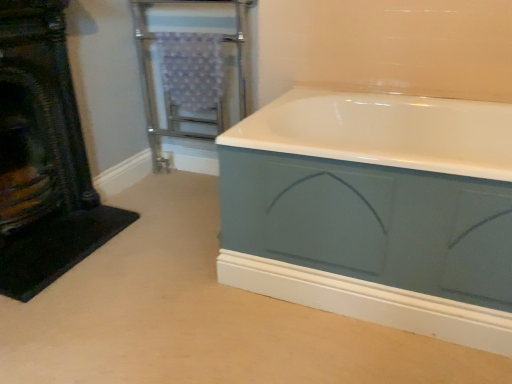
Question: Is metallic silver towel rack at upper left positioned before matte blue bathtub at center?

Choices:
 (A) no
 (B) yes

Answer: (A)

Question: Is metallic silver towel rack at upper left shorter than matte blue bathtub at center?

Choices:
 (A) no
 (B) yes

Answer: (A)

Question: Can you confirm if metallic silver towel rack at upper left is positioned to the right of matte blue bathtub at center?

Choices:
 (A) yes
 (B) no

Answer: (B)

Question: From a real-world perspective, is metallic silver towel rack at upper left on top of matte blue bathtub at center?

Choices:
 (A) yes
 (B) no

Answer: (A)

Question: Is the depth of metallic silver towel rack at upper left greater than that of matte blue bathtub at center?

Choices:
 (A) yes
 (B) no

Answer: (A)

Question: From a real-world perspective, is matte blue bathtub at center positioned above or below black textured fireplace at left?

Choices:
 (A) above
 (B) below

Answer: (B)

Question: From the image's perspective, relative to black textured fireplace at left, is matte blue bathtub at center above or below?

Choices:
 (A) above
 (B) below

Answer: (B)

Question: In terms of width, does matte blue bathtub at center look wider or thinner when compared to black textured fireplace at left?

Choices:
 (A) thin
 (B) wide

Answer: (B)

Question: Would you say matte blue bathtub at center is to the left or to the right of black textured fireplace at left in the picture?

Choices:
 (A) left
 (B) right

Answer: (B)

Question: From the image's perspective, is black textured fireplace at left located above or below metallic silver towel rack at upper left?

Choices:
 (A) below
 (B) above

Answer: (A)

Question: From a real-world perspective, is black textured fireplace at left above or below metallic silver towel rack at upper left?

Choices:
 (A) below
 (B) above

Answer: (B)

Question: Is point (90, 188) positioned closer to the camera than point (148, 44)?

Choices:
 (A) closer
 (B) farther

Answer: (A)

Question: In terms of width, does black textured fireplace at left look wider or thinner when compared to metallic silver towel rack at upper left?

Choices:
 (A) thin
 (B) wide

Answer: (A)

Question: Considering the positions of matte blue bathtub at center and metallic silver towel rack at upper left in the image, is matte blue bathtub at center bigger or smaller than metallic silver towel rack at upper left?

Choices:
 (A) small
 (B) big

Answer: (B)

Question: From the image's perspective, is matte blue bathtub at center located above or below metallic silver towel rack at upper left?

Choices:
 (A) above
 (B) below

Answer: (B)